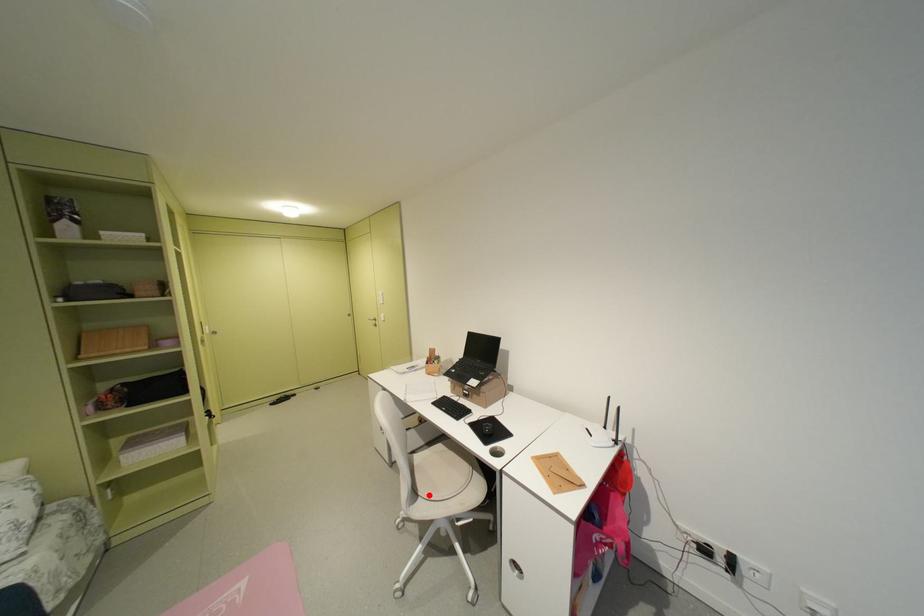
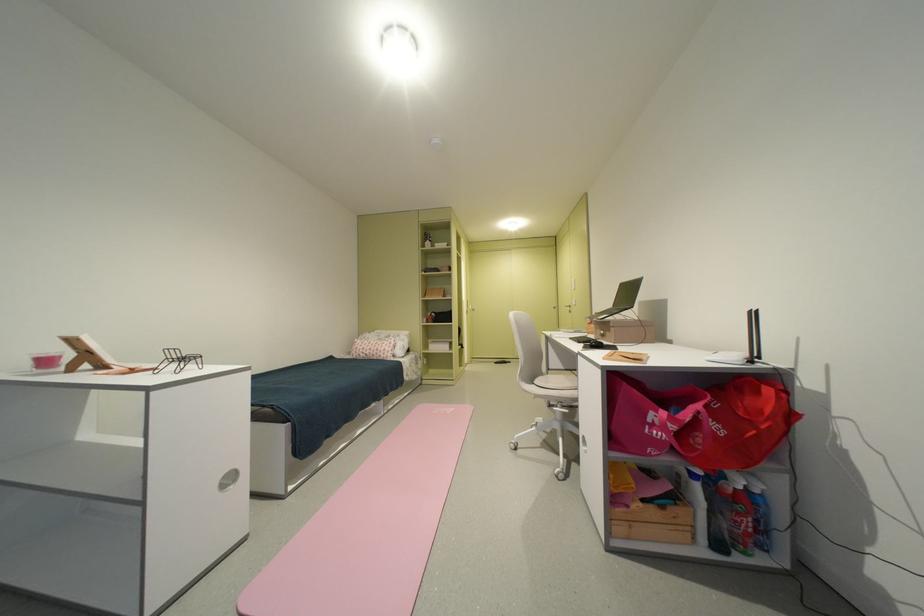
In the second image, find the point that corresponds to the highlighted location in the first image.

(543, 383)